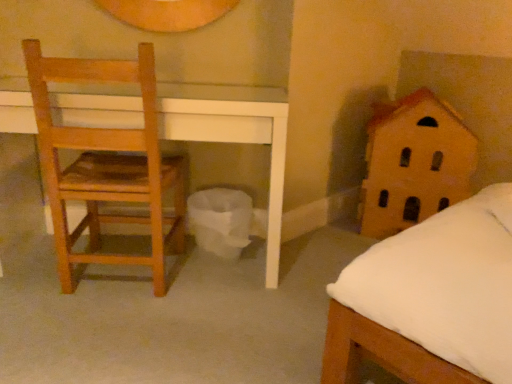
At what (x,y) coordinates should I click in order to perform the action: click on vacant space in wooden chair at left (from a real-world perspective). Please return your answer as a coordinate pair (x, y). Image resolution: width=512 pixels, height=384 pixels. Looking at the image, I should click on (118, 284).